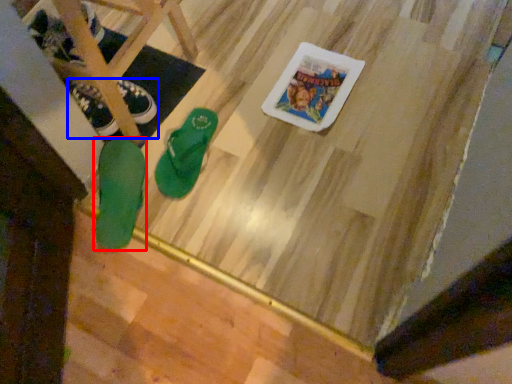
Question: Which object is closer to the camera taking this photo, footwear (highlighted by a red box) or footwear (highlighted by a blue box)?

Choices:
 (A) footwear
 (B) footwear

Answer: (A)